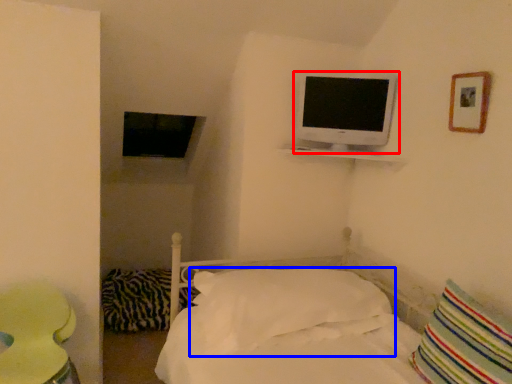
Question: Which point is further to the camera, television (highlighted by a red box) or pillow (highlighted by a blue box)?

Choices:
 (A) television
 (B) pillow

Answer: (A)